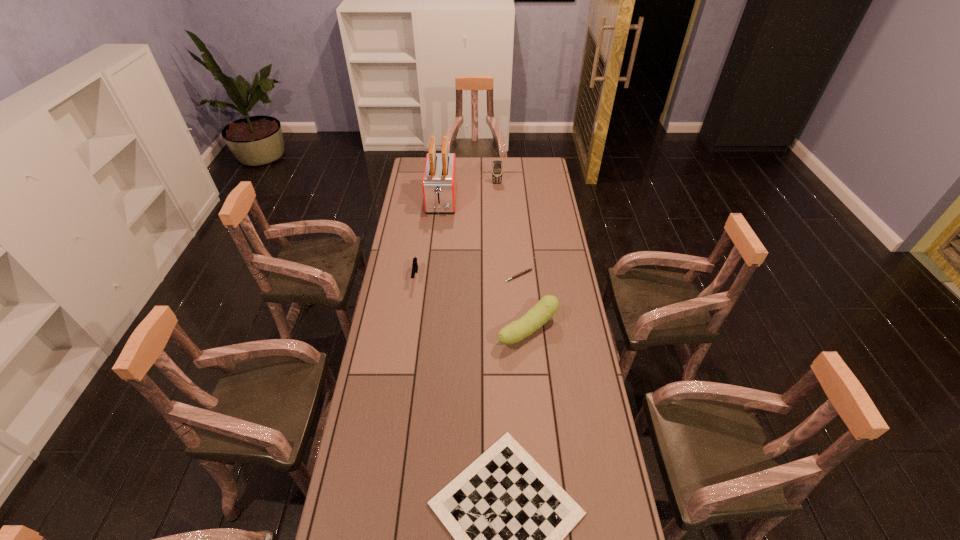
Find the location of a particular element. This screenshot has width=960, height=540. toaster is located at coordinates (439, 182).

You are a GUI agent. You are given a task and a screenshot of the screen. Output one action in this format:
    pyautogui.click(x=<x>, y=<y>)
    Task: Click on the second tallest object
    The image size is (960, 540).
    Given the screenshot: What is the action you would take?
    (497, 168)

The image size is (960, 540). What are the coordinates of `cucumber` in the screenshot? It's located at (547, 306).

Where is `the second nearest object`? the second nearest object is located at coordinates (547, 306).

The width and height of the screenshot is (960, 540). Identify the location of pistol. (414, 265).

I want to click on the second shortest object, so click(529, 269).

The width and height of the screenshot is (960, 540). Identify the location of vacant area situated 0.240m on the front-facing side of the tallest object. (437, 249).

At what (x,y) coordinates should I click in order to perform the action: click on vacant space situated 0.150m on the front face of the second tallest object. Please return your answer as a coordinate pair (x, y). The width and height of the screenshot is (960, 540). Looking at the image, I should click on (498, 200).

Where is `free space located 0.120m on the left of the cucumber`? This screenshot has width=960, height=540. free space located 0.120m on the left of the cucumber is located at coordinates (467, 330).

I want to click on vacant space situated on the front-facing side of the fourth tallest object, so click(411, 308).